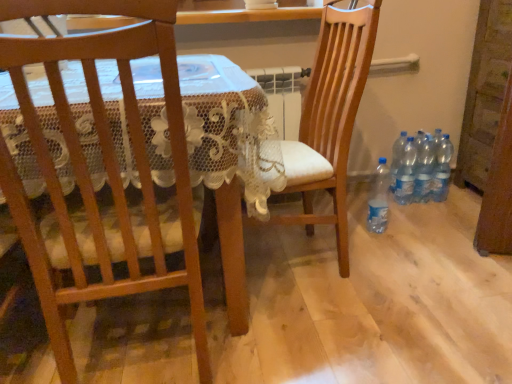
Find the location of a particular element. spots to the right of wooden chair at center, which is counted as the 1th chair, starting from the right is located at coordinates (400, 269).